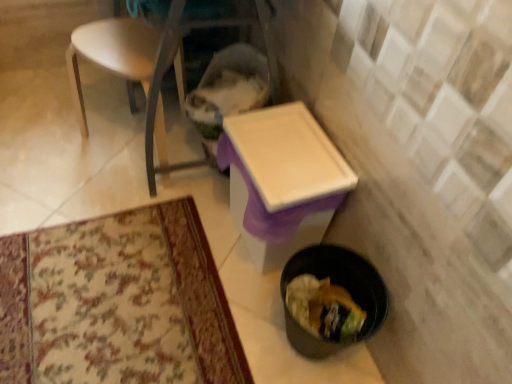
Question: In the image, is black plastic trash can at lower right positioned in front of or behind white plastic chair at upper left?

Choices:
 (A) front
 (B) behind

Answer: (A)

Question: Do you think black plastic trash can at lower right is within white plastic chair at upper left, or outside of it?

Choices:
 (A) inside
 (B) outside

Answer: (B)

Question: Considering the real-world distances, which object is farthest from the white plastic chair at upper left?

Choices:
 (A) white plastic table at center
 (B) black plastic trash can at lower right

Answer: (B)

Question: Estimate the real-world distances between objects in this image. Which object is farther from the white plastic chair at upper left?

Choices:
 (A) white plastic table at center
 (B) black plastic trash can at lower right

Answer: (B)